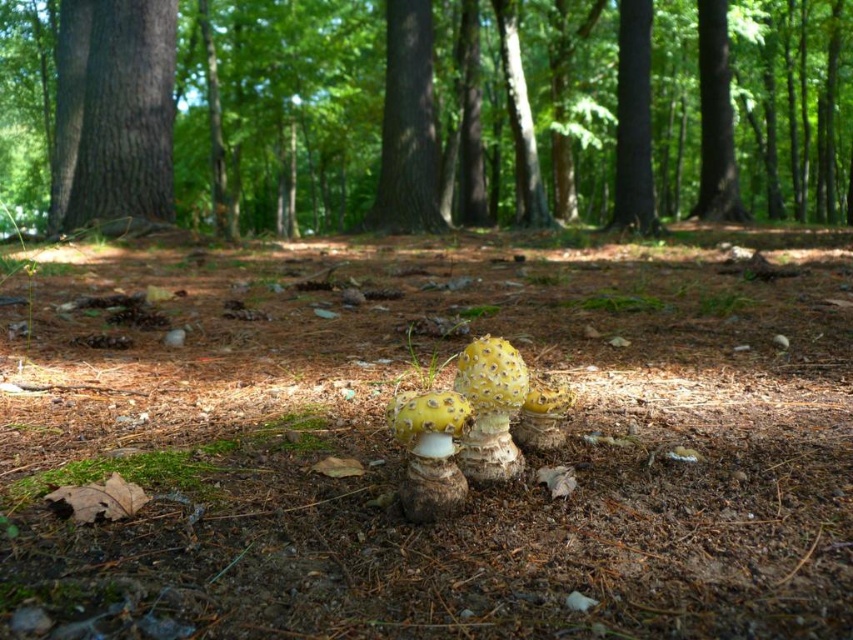
Question: Does brown textured tree trunk at center have a smaller size compared to smooth brown tree trunk at upper left?

Choices:
 (A) no
 (B) yes

Answer: (A)

Question: Which object is closer to the camera taking this photo?

Choices:
 (A) smooth bark tree at center
 (B) smooth brown tree trunk at upper left
 (C) smooth dark brown tree trunk at upper center
 (D) brown textured tree trunk at center

Answer: (B)

Question: Does smooth brown tree trunk at upper left lie in front of smooth dark brown tree trunk at upper center?

Choices:
 (A) no
 (B) yes

Answer: (B)

Question: Considering the real-world distances, which object is farthest from the brown textured tree trunk at center?

Choices:
 (A) smooth brown tree trunk at upper left
 (B) smooth dark brown tree trunk at upper center
 (C) smooth bark tree at center

Answer: (B)

Question: Which point is closer to the camera?

Choices:
 (A) (624, 22)
 (B) (93, 97)
 (C) (151, 28)
 (D) (387, 182)

Answer: (C)

Question: From the image, what is the correct spatial relationship of brown textured tree trunk at center in relation to smooth dark brown tree trunk at upper center?

Choices:
 (A) above
 (B) below

Answer: (A)